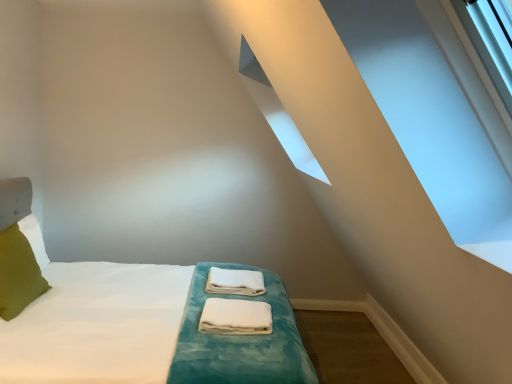
Describe the element at coordinates (18, 273) in the screenshot. Image resolution: width=512 pixels, height=384 pixels. I see `green fabric pillow at left` at that location.

This screenshot has height=384, width=512. What do you see at coordinates (234, 282) in the screenshot? I see `white fabric towels at center, which ranks as the 1th material in back-to-front order` at bounding box center [234, 282].

Where is `white soft bed at center`? Image resolution: width=512 pixels, height=384 pixels. white soft bed at center is located at coordinates point(146,330).

Is white fabric towels at center, which ranks as the 1th material in back-to-front order, positioned beyond the bounds of green fabric pillow at left?

Indeed, white fabric towels at center, which ranks as the 1th material in back-to-front order, is completely outside green fabric pillow at left.

Locate an element on the screen. The image size is (512, 384). the 1st material below when counting from the green fabric pillow at left (from the image's perspective) is located at coordinates (234, 282).

From a real-world perspective, is white fabric towels at center, which ranks as the 1th material in back-to-front order, above or below green fabric pillow at left?

Clearly, from a real-world perspective, white fabric towels at center, which ranks as the 1th material in back-to-front order, is below green fabric pillow at left.

From the picture: Is the position of white fabric towels at center, marked as the 2th material in a front-to-back arrangement, more distant than that of green fabric pillow at left?

Yes, white fabric towels at center, marked as the 2th material in a front-to-back arrangement, is further from the camera.

Are white cotton towels at center, which is the second material from back to front, and green fabric pillow at left located far from each other?

Yes, white cotton towels at center, which is the second material from back to front, is far from green fabric pillow at left.

The image size is (512, 384). Identify the location of pillow on the left of white cotton towels at center, marked as the first material in a front-to-back arrangement. (18, 273).

From the image's perspective, who appears lower, white cotton towels at center, which is the second material from back to front, or green fabric pillow at left?

white cotton towels at center, which is the second material from back to front, from the image's perspective.

Can you confirm if white fabric towels at center, marked as the 2th material in a front-to-back arrangement, is positioned to the right of white cotton towels at center, which is the second material from back to front?

In fact, white fabric towels at center, marked as the 2th material in a front-to-back arrangement, is to the left of white cotton towels at center, which is the second material from back to front.

Is white fabric towels at center, marked as the 2th material in a front-to-back arrangement, next to white cotton towels at center, which is the second material from back to front, and touching it?

They are not placed beside each other.

Is point (251, 287) closer or farther from the camera than point (251, 320)?

Point (251, 287) appears to be farther away from the viewer than point (251, 320).

Between green fabric pillow at left and white soft bed at center, which one appears on the left side from the viewer's perspective?

From the viewer's perspective, green fabric pillow at left appears more on the left side.

Which of these two, green fabric pillow at left or white soft bed at center, is bigger?

With larger size is white soft bed at center.

Who is shorter, green fabric pillow at left or white soft bed at center?

With less height is green fabric pillow at left.

How different are the orientations of green fabric pillow at left and white soft bed at center in degrees?

The facing directions of green fabric pillow at left and white soft bed at center are 4.38 degrees apart.

Based on the photo, between green fabric pillow at left and white cotton towels at center, marked as the first material in a front-to-back arrangement, which one has smaller width?

With smaller width is green fabric pillow at left.

Is point (30, 288) behind point (244, 334)?

Yes, point (30, 288) is farther from viewer.

I want to click on pillow above the white cotton towels at center, which is the second material from back to front (from a real-world perspective), so click(18, 273).

Consider the image. Is white fabric towels at center, which ranks as the 1th material in back-to-front order, at the back of green fabric pillow at left?

green fabric pillow at left is not turned away from white fabric towels at center, which ranks as the 1th material in back-to-front order.

From the picture: Does green fabric pillow at left have a lesser height compared to white fabric towels at center, which ranks as the 1th material in back-to-front order?

Incorrect, the height of green fabric pillow at left does not fall short of that of white fabric towels at center, which ranks as the 1th material in back-to-front order.

Which object is positioned more to the left, green fabric pillow at left or white fabric towels at center, which ranks as the 1th material in back-to-front order?

green fabric pillow at left.

Considering the relative positions of green fabric pillow at left and white fabric towels at center, which ranks as the 1th material in back-to-front order, in the image provided, is green fabric pillow at left in front of white fabric towels at center, which ranks as the 1th material in back-to-front order,?

Yes, green fabric pillow at left is in front of white fabric towels at center, which ranks as the 1th material in back-to-front order.

Can you confirm if white cotton towels at center, which is the second material from back to front, is positioned to the left of white soft bed at center?

Incorrect, white cotton towels at center, which is the second material from back to front, is not on the left side of white soft bed at center.

Where is `bed on the left side of white cotton towels at center, which is the second material from back to front`? The image size is (512, 384). bed on the left side of white cotton towels at center, which is the second material from back to front is located at coordinates (146, 330).

Is white cotton towels at center, which is the second material from back to front, taller than white soft bed at center?

Incorrect, the height of white cotton towels at center, which is the second material from back to front, is not larger of that of white soft bed at center.

Is white cotton towels at center, marked as the first material in a front-to-back arrangement, aimed at white soft bed at center?

Yes, white cotton towels at center, marked as the first material in a front-to-back arrangement, is turned towards white soft bed at center.

Find the location of a particular element. the 1st material located beneath the green fabric pillow at left (from a real-world perspective) is located at coordinates (234, 282).

Image resolution: width=512 pixels, height=384 pixels. I want to click on pillow positioned vertically above the white cotton towels at center, marked as the first material in a front-to-back arrangement (from a real-world perspective), so click(x=18, y=273).

Which object lies further to the anchor point green fabric pillow at left, white soft bed at center or white cotton towels at center, marked as the first material in a front-to-back arrangement?

The object further to green fabric pillow at left is white cotton towels at center, marked as the first material in a front-to-back arrangement.

Based on their spatial positions, is white fabric towels at center, marked as the 2th material in a front-to-back arrangement, or green fabric pillow at left closer to white soft bed at center?

Among the two, green fabric pillow at left is located nearer to white soft bed at center.

Estimate the real-world distances between objects in this image. Which object is further from white soft bed at center, white fabric towels at center, which ranks as the 1th material in back-to-front order, or white cotton towels at center, marked as the first material in a front-to-back arrangement?

white fabric towels at center, which ranks as the 1th material in back-to-front order, is positioned further to the anchor white soft bed at center.

Looking at the image, which one is located further to white soft bed at center, white cotton towels at center, which is the second material from back to front, or white fabric towels at center, which ranks as the 1th material in back-to-front order?

white fabric towels at center, which ranks as the 1th material in back-to-front order, is positioned further to the anchor white soft bed at center.

From the image, which object appears to be farther from green fabric pillow at left, white cotton towels at center, marked as the first material in a front-to-back arrangement, or white soft bed at center?

white cotton towels at center, marked as the first material in a front-to-back arrangement.

Based on their spatial positions, is white fabric towels at center, which ranks as the 1th material in back-to-front order, or white cotton towels at center, which is the second material from back to front, further from green fabric pillow at left?

white cotton towels at center, which is the second material from back to front, lies further to green fabric pillow at left than the other object.

In the scene shown: From the image, which object appears to be farther from white fabric towels at center, which ranks as the 1th material in back-to-front order, green fabric pillow at left or white soft bed at center?

green fabric pillow at left is positioned further to the anchor white fabric towels at center, which ranks as the 1th material in back-to-front order.

Based on the photo, looking at the image, which one is located further to white soft bed at center, white cotton towels at center, which is the second material from back to front, or green fabric pillow at left?

green fabric pillow at left.

You are a GUI agent. You are given a task and a screenshot of the screen. Output one action in this format:
    pyautogui.click(x=<x>, y=<y>)
    Task: Click on the material between white soft bed at center and white fabric towels at center, which ranks as the 1th material in back-to-front order, from front to back
    The height and width of the screenshot is (384, 512).
    Given the screenshot: What is the action you would take?
    pyautogui.click(x=234, y=317)

Identify the location of bed located between green fabric pillow at left and white fabric towels at center, which ranks as the 1th material in back-to-front order, in the left-right direction. The height and width of the screenshot is (384, 512). (146, 330).

I want to click on bed between green fabric pillow at left and white cotton towels at center, marked as the first material in a front-to-back arrangement, in the horizontal direction, so click(146, 330).

Where is `material between green fabric pillow at left and white cotton towels at center, which is the second material from back to front, from left to right`? Image resolution: width=512 pixels, height=384 pixels. material between green fabric pillow at left and white cotton towels at center, which is the second material from back to front, from left to right is located at coordinates (234, 282).